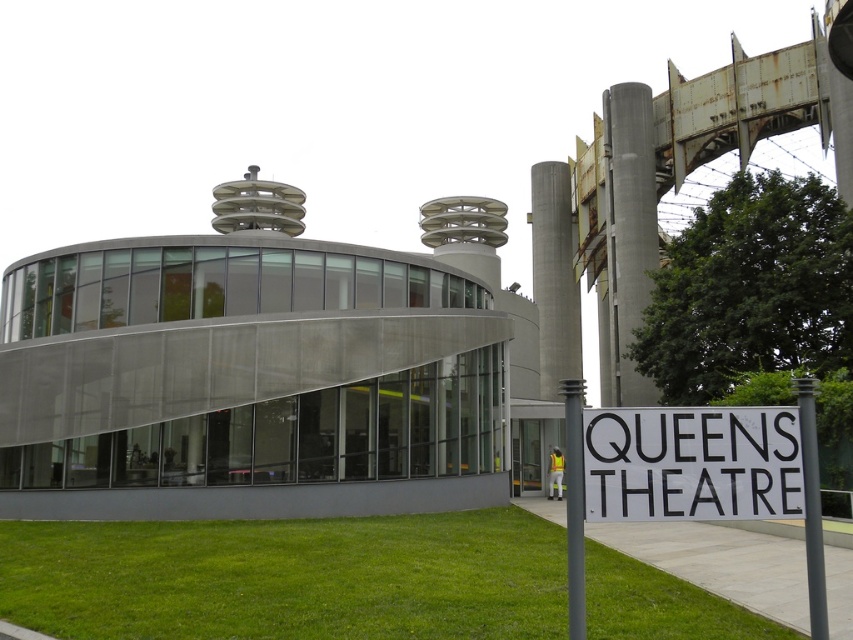
Who is more distant from viewer, (7,536) or (577,372)?

The point (577,372) is more distant.

Who is shorter, green grass at lower center or concrete at center?

green grass at lower center is shorter.

This screenshot has height=640, width=853. I want to click on green grass at lower center, so click(x=289, y=577).

This screenshot has width=853, height=640. What are the coordinates of `green grass at lower center` in the screenshot? It's located at (289, 577).

Which is in front, point (194, 628) or point (643, 401)?

Point (194, 628) is in front.

Is point (53, 532) closer to viewer compared to point (624, 144)?

Yes, point (53, 532) is in front of point (624, 144).

In order to click on green grass at lower center in this screenshot , I will do `click(289, 577)`.

Does white plastic sign at lower right have a lesser height compared to concrete at center?

Correct, white plastic sign at lower right is not as tall as concrete at center.

Between white plastic sign at lower right and concrete at center, which one has less height?

With less height is white plastic sign at lower right.

Between point (584, 516) and point (576, 337), which one is positioned behind?

Point (576, 337)

In order to click on white plastic sign at lower right in this screenshot , I will do `click(692, 464)`.